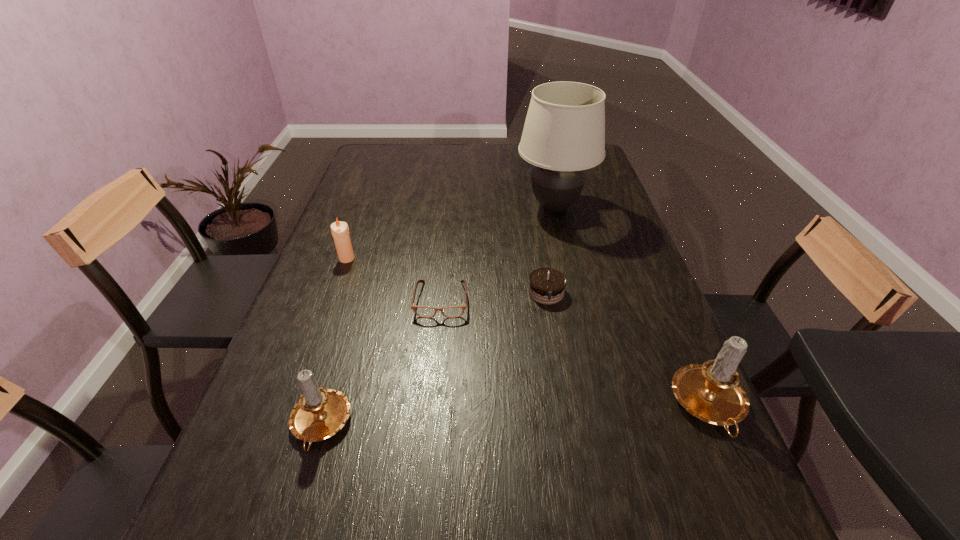
To ensure equal spacing by inserting another candle among them, please point out a vacant spot for this new candle. Please provide its 2D coordinates. Your answer should be formatted as a tuple, i.e. [(x, y)], where the tuple contains the x and y coordinates of a point satisfying the conditions above.

[(518, 416)]